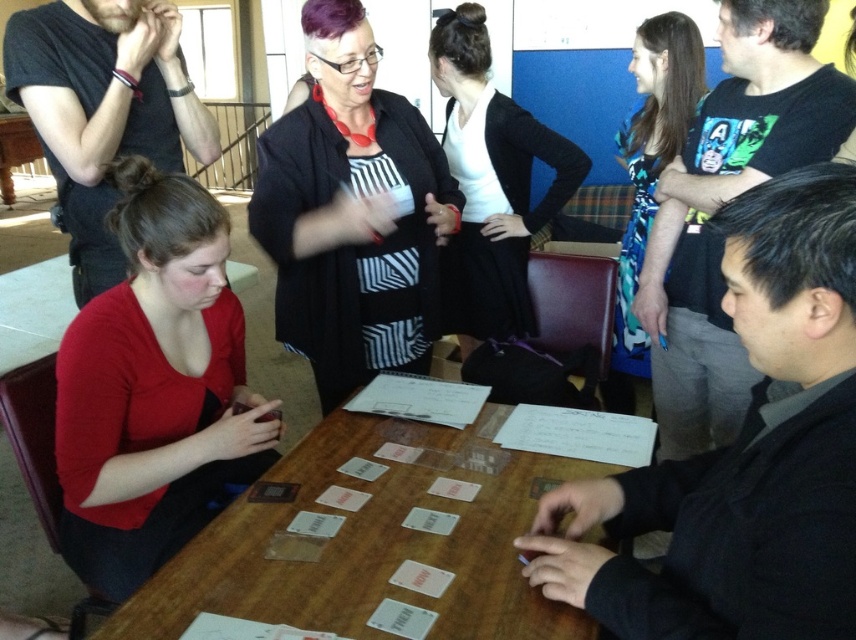
Can you confirm if wooden table at center is positioned to the right of black knit cardigan at center?

In fact, wooden table at center is to the left of black knit cardigan at center.

Is wooden table at center bigger than black knit cardigan at center?

No.

Does point (100, 636) come closer to viewer compared to point (480, 13)?

Yes, it is.

At what (x,y) coordinates should I click in order to perform the action: click on wooden table at center. Please return your answer as a coordinate pair (x, y). The width and height of the screenshot is (856, 640). Looking at the image, I should click on (372, 540).

Does black textured sweater at center appear under blue floral dress at upper right?

Yes, black textured sweater at center is below blue floral dress at upper right.

Can you confirm if black textured sweater at center is thinner than blue floral dress at upper right?

No, black textured sweater at center is not thinner than blue floral dress at upper right.

Who is more forward, (337, 140) or (646, 221)?

Point (337, 140)

The height and width of the screenshot is (640, 856). Identify the location of black textured sweater at center. (351, 212).

In the scene shown: Does matte red shirt at lower left come behind black knit cardigan at center?

No, matte red shirt at lower left is in front of black knit cardigan at center.

Between matte red shirt at lower left and black knit cardigan at center, which one has more height?

black knit cardigan at center

The height and width of the screenshot is (640, 856). What do you see at coordinates (155, 388) in the screenshot?
I see `matte red shirt at lower left` at bounding box center [155, 388].

Find the location of a particular element. The width and height of the screenshot is (856, 640). matte red shirt at lower left is located at coordinates (155, 388).